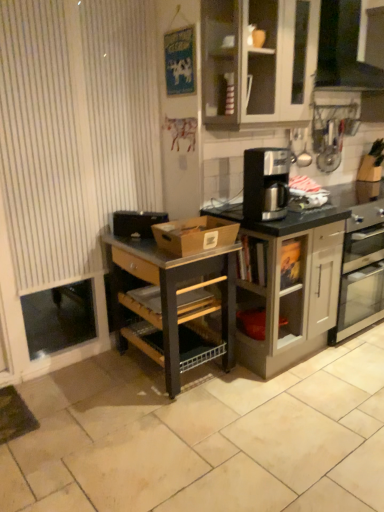
At what (x,y) coordinates should I click in order to perform the action: click on free point above beige tile at lower center (from a real-world perspective). Please return your answer as a coordinate pair (x, y). The image size is (384, 512). Looking at the image, I should click on (254, 418).